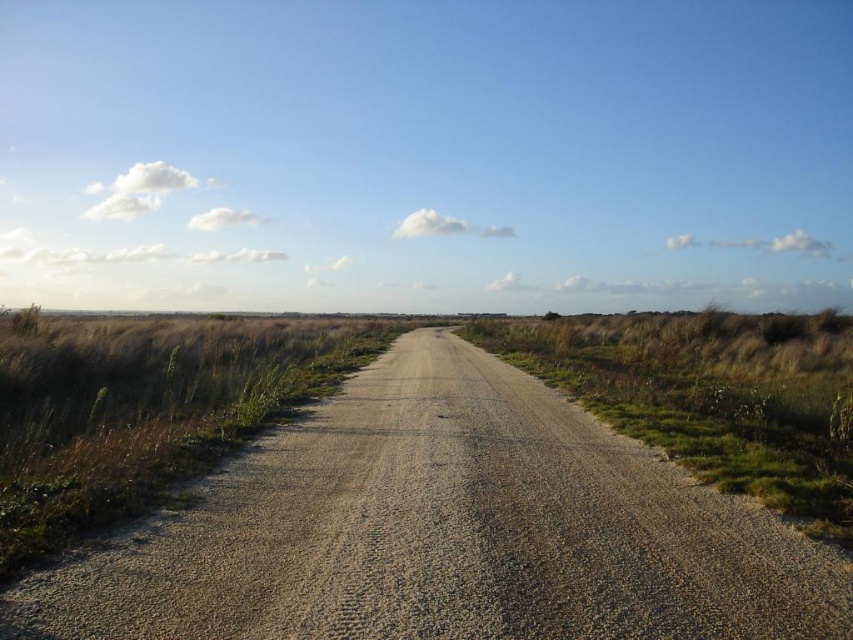
Question: Which point is farther to the camera?

Choices:
 (A) brown gravel road at center
 (B) green grass at right

Answer: (B)

Question: Which point appears closest to the camera in this image?

Choices:
 (A) (747, 481)
 (B) (115, 544)

Answer: (B)

Question: Is brown gravel road at center positioned before green grass at right?

Choices:
 (A) yes
 (B) no

Answer: (A)

Question: Is brown gravel road at center thinner than green grass at right?

Choices:
 (A) yes
 (B) no

Answer: (A)

Question: Can you confirm if brown gravel road at center is thinner than green grass at right?

Choices:
 (A) yes
 (B) no

Answer: (A)

Question: Among these objects, which one is nearest to the camera?

Choices:
 (A) green grass at right
 (B) brown gravel road at center

Answer: (B)